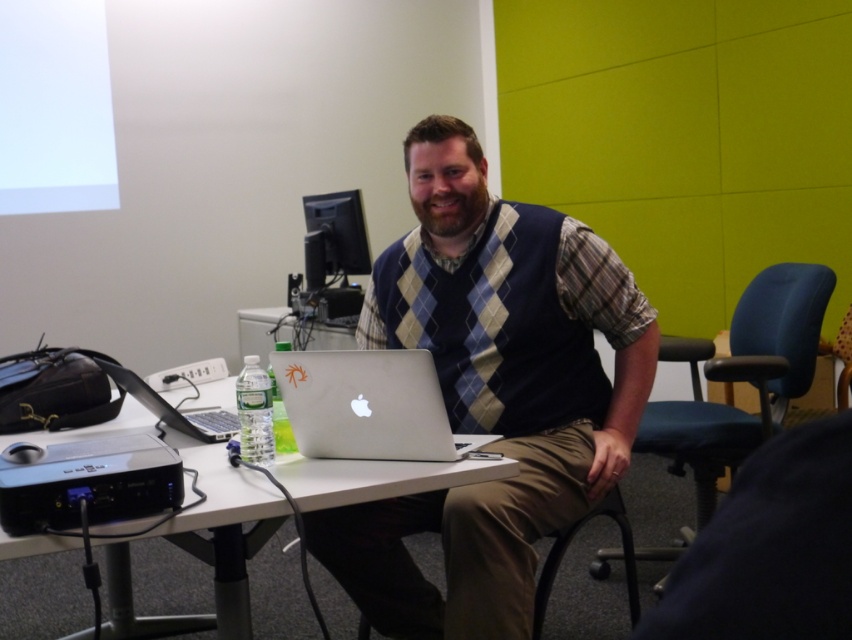
You are a person who needs to sit down quickly. You see a blue fabric swivel chair at right and a black plastic projector at lower left. Which object is located to the right side of the other?

The blue fabric swivel chair at right is located to the right of the black plastic projector at lower left.

You are a photographer standing in front of the scene. You want to take a photo of the knit sweater vest at center and the white plastic table at center. Which object will appear larger in the photo?

The knit sweater vest at center will appear larger in the photo because it is taller than the white plastic table at center.

You are standing in front of the table and want to reach both points on the table. Which point, point (x=530, y=444) or point (x=119, y=556), is closer to you?

Point (x=530, y=444) is closer to the camera than point (x=119, y=556), so it is closer to you.